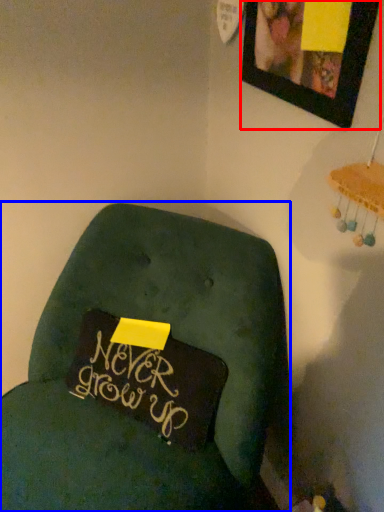
Question: Which point is further to the camera, picture frame (highlighted by a red box) or furniture (highlighted by a blue box)?

Choices:
 (A) picture frame
 (B) furniture

Answer: (A)